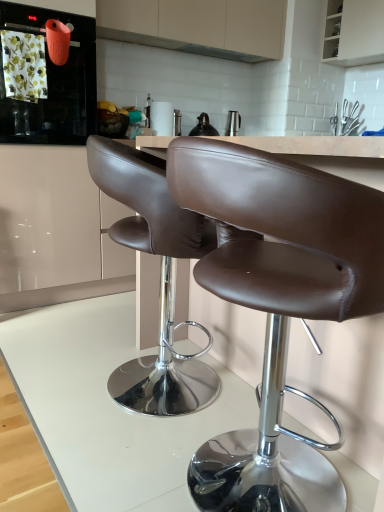
Question: Is black matte tea pot at upper center inside or outside of metallic silver exhaust hood at upper center?

Choices:
 (A) outside
 (B) inside

Answer: (A)

Question: From a real-world perspective, is black matte tea pot at upper center positioned above or below metallic silver exhaust hood at upper center?

Choices:
 (A) below
 (B) above

Answer: (A)

Question: Considering the real-world distances, which object is farthest from the white glossy table at center?

Choices:
 (A) white glossy cabinet at upper right, placed as the first cabinetry when sorted from right to left
 (B) matte orange kettle at upper left
 (C) brown leather chair at center, the 2th chair positioned from the front
 (D) metallic silver exhaust hood at upper center
 (E) matte beige cabinet at upper center, the second cabinetry positioned from the right

Answer: (A)

Question: Based on their relative distances, which object is farther from the white glossy table at center?

Choices:
 (A) brown leather chair at center, which is counted as the 2th chair, starting from the back
 (B) white glossy cabinet at upper right, marked as the 2th cabinetry in a left-to-right arrangement
 (C) metallic silver exhaust hood at upper center
 (D) matte orange kettle at upper left
 (E) matte beige cabinet at upper center, the second cabinetry positioned from the right

Answer: (B)